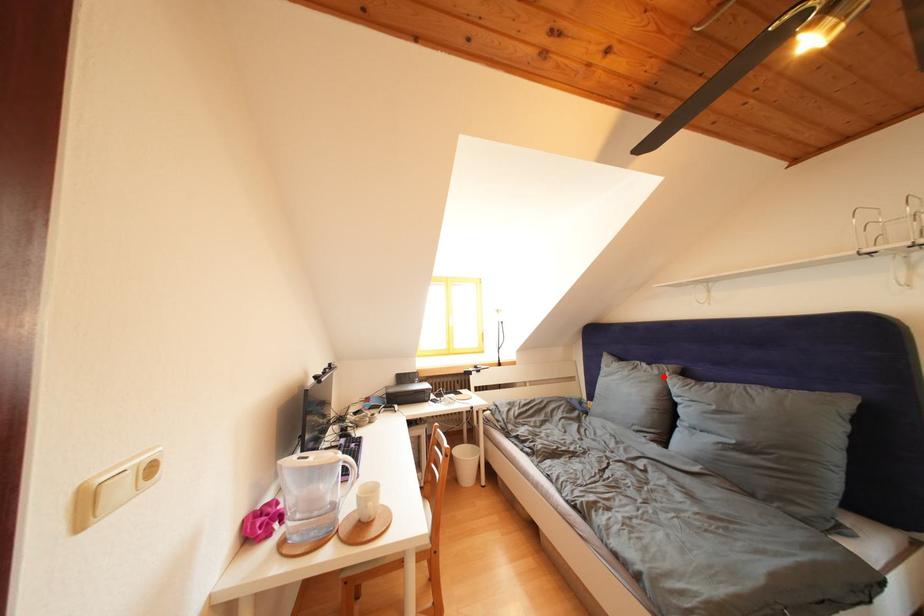
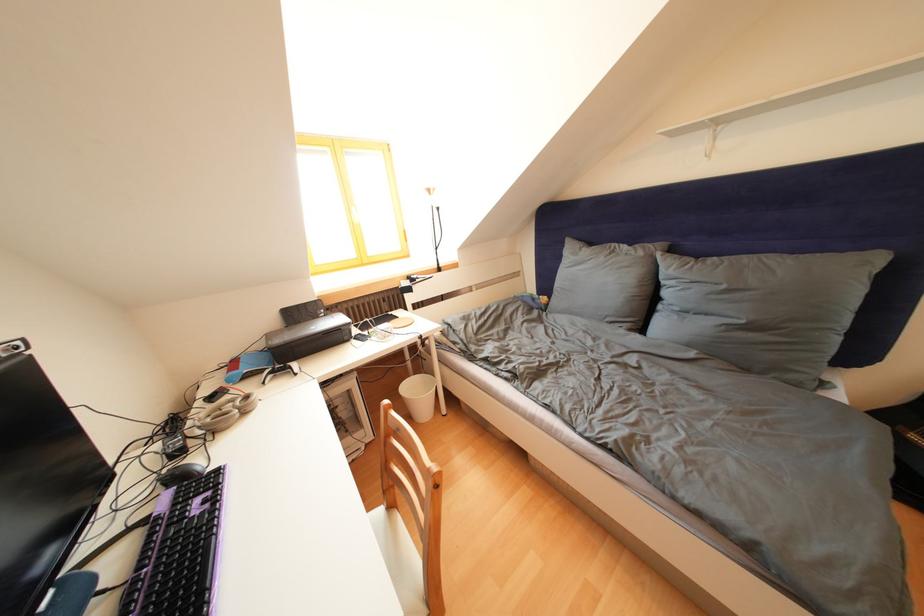
Where in the second image is the point corresponding to the highlighted location from the first image?

(649, 259)